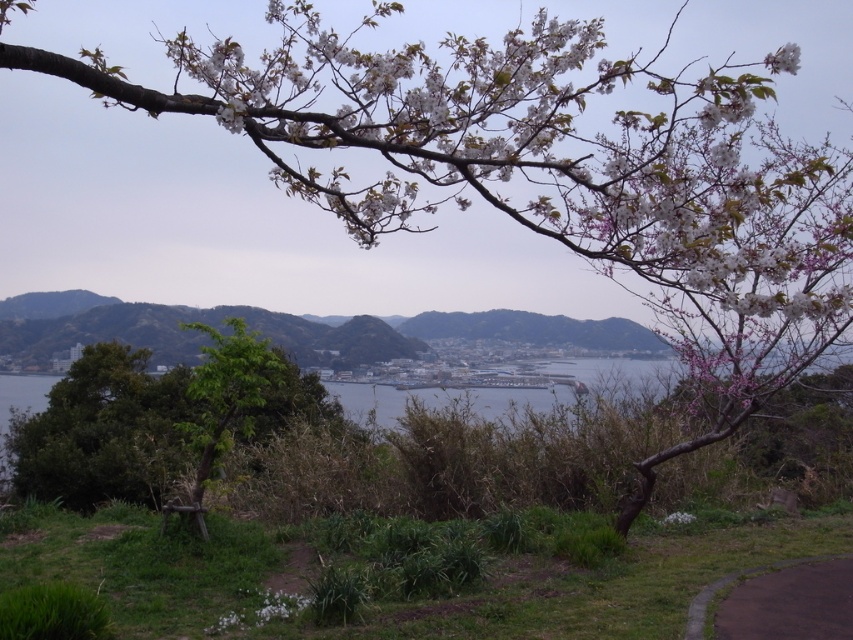
Does green leafy tree at center appear on the right side of paved asphalt path at lower right?

Incorrect, green leafy tree at center is not on the right side of paved asphalt path at lower right.

Between green leafy tree at center and paved asphalt path at lower right, which one has less height?

paved asphalt path at lower right

Which is in front, point (224, 403) or point (799, 557)?

Positioned in front is point (799, 557).

The image size is (853, 640). I want to click on green leafy tree at center, so click(155, 419).

Is the position of green leafy tree at center more distant than that of white matte flower at upper right?

Yes, it is.

Is green leafy tree at center bigger than white matte flower at upper right?

Actually, green leafy tree at center might be smaller than white matte flower at upper right.

What do you see at coordinates (155, 419) in the screenshot? The width and height of the screenshot is (853, 640). I see `green leafy tree at center` at bounding box center [155, 419].

At what (x,y) coordinates should I click in order to perform the action: click on green leafy tree at center. Please return your answer as a coordinate pair (x, y). The image size is (853, 640). Looking at the image, I should click on (155, 419).

Can you confirm if paved asphalt path at lower right is positioned to the right of white matte flower at upper right?

Incorrect, paved asphalt path at lower right is not on the right side of white matte flower at upper right.

Does point (723, 582) come farther from viewer compared to point (781, 60)?

That is True.

Locate an element on the screen. The width and height of the screenshot is (853, 640). paved asphalt path at lower right is located at coordinates (732, 582).